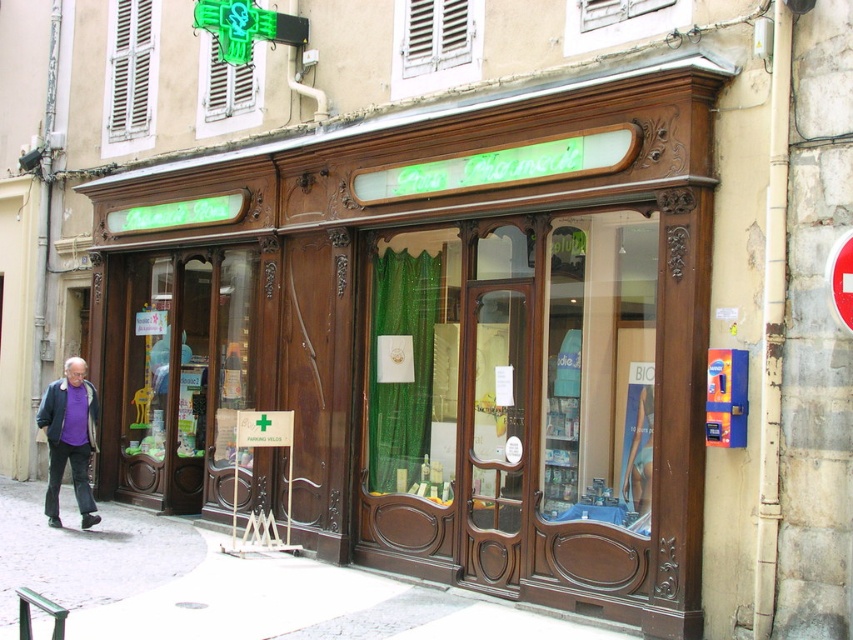
Question: Estimate the real-world distances between objects in this image. Which object is closer to the green fabric curtains at center?

Choices:
 (A) wooden storefront at center
 (B) white concrete pavement at lower center

Answer: (A)

Question: Does green fabric curtains at center have a smaller size compared to purple soft fabric jacket at lower left?

Choices:
 (A) yes
 (B) no

Answer: (B)

Question: Does wooden storefront at center appear on the right side of green fabric curtains at center?

Choices:
 (A) yes
 (B) no

Answer: (B)

Question: Is green fabric curtains at center further to camera compared to white concrete pavement at lower center?

Choices:
 (A) no
 (B) yes

Answer: (B)

Question: Estimate the real-world distances between objects in this image. Which object is closer to the green fabric curtains at center?

Choices:
 (A) purple soft fabric jacket at lower left
 (B) wooden storefront at center

Answer: (B)

Question: Which is nearer to the green fabric curtains at center?

Choices:
 (A) wooden storefront at center
 (B) purple soft fabric jacket at lower left

Answer: (A)